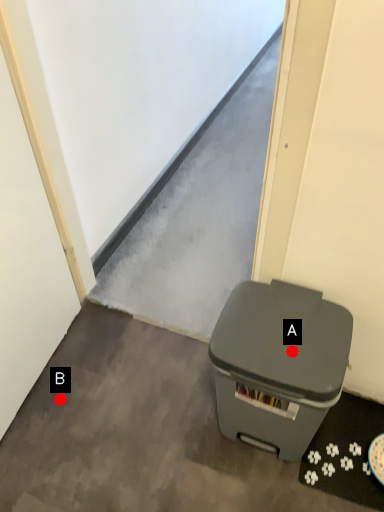
Question: Two points are circled on the image, labeled by A and B beside each circle. Which of the following is the farthest from the observer?

Choices:
 (A) A is further
 (B) B is further

Answer: (B)